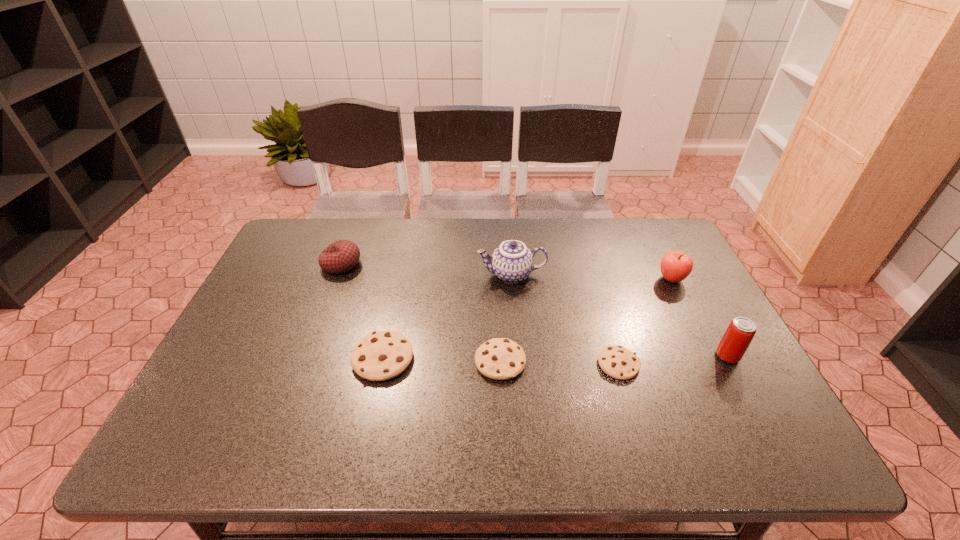
All cookies are currently evenly spaced. To continue this pattern, where would you add another cookie on the right? Please point out a vacant spot. Please provide its 2D coordinates. Your answer should be formatted as a tuple, i.e. [(x, y)], where the tuple contains the x and y coordinates of a point satisfying the conditions above.

[(739, 368)]